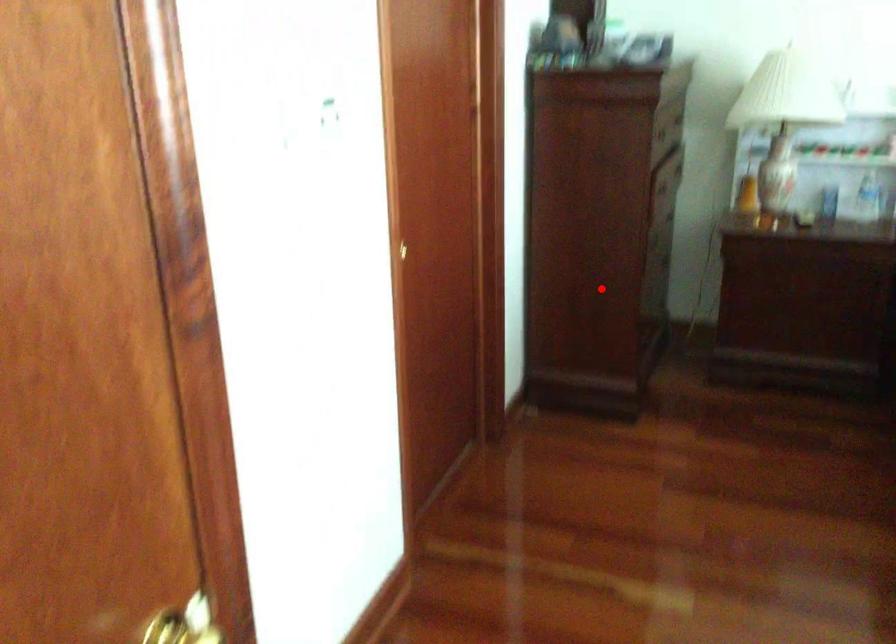
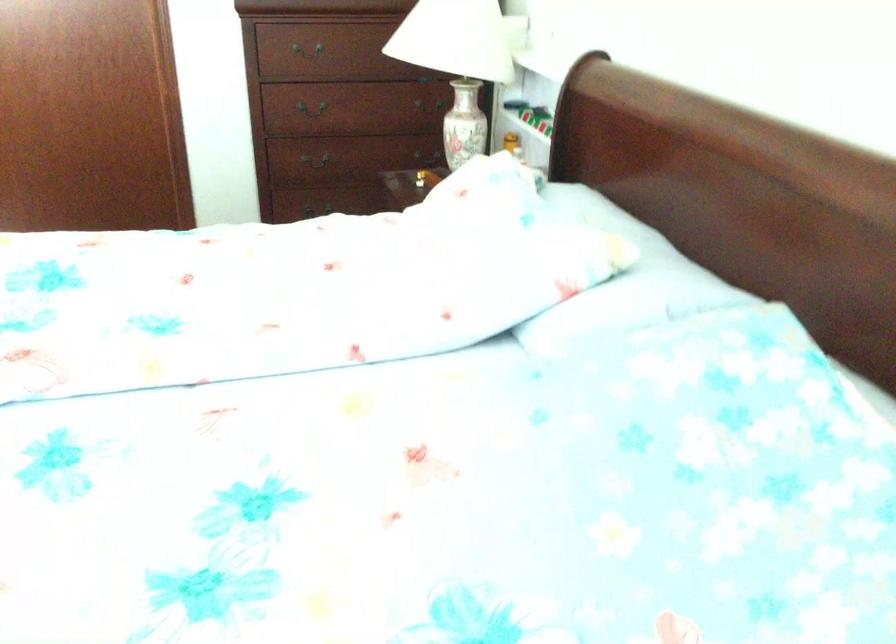
Locate, in the second image, the point that corresponds to the highlighted location in the first image.

(321, 200)